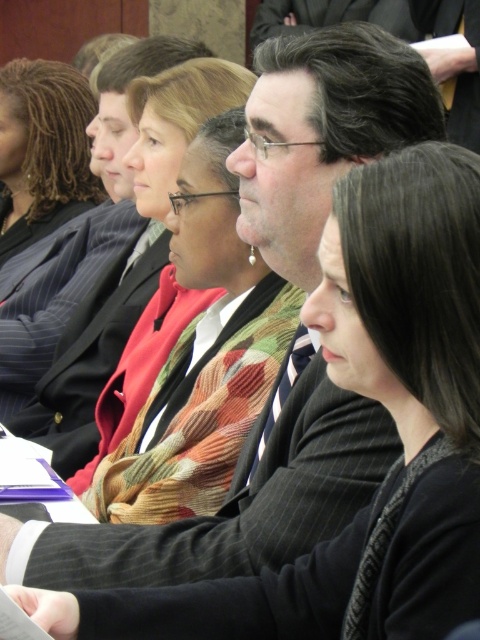
Question: Which object is farther from the camera taking this photo?

Choices:
 (A) knitted scarf at center
 (B) matte black suit at upper left

Answer: (B)

Question: Is knitted scarf at center further to the viewer compared to matte black suit at upper left?

Choices:
 (A) yes
 (B) no

Answer: (B)

Question: Is knitted scarf at center above matte black suit at upper left?

Choices:
 (A) yes
 (B) no

Answer: (B)

Question: Is knitted scarf at center to the left of matte black suit at upper left from the viewer's perspective?

Choices:
 (A) yes
 (B) no

Answer: (B)